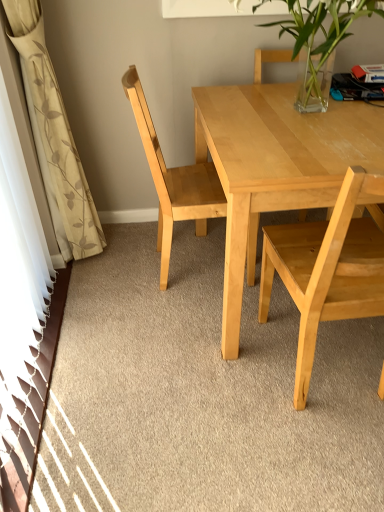
You are a GUI agent. You are given a task and a screenshot of the screen. Output one action in this format:
    pyautogui.click(x=<x>, y=<y>)
    Task: Click on the vacant space underneath light wood chair at center, placed as the 2th chair when sorted from right to left (from a real-world perspective)
    This screenshot has height=512, width=384.
    Given the screenshot: What is the action you would take?
    pyautogui.click(x=189, y=264)